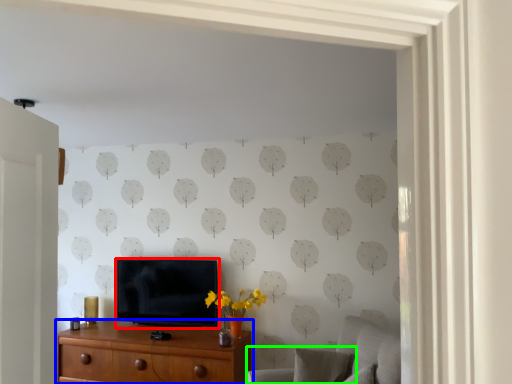
Question: Based on their relative distances, which object is farther from television (highlighted by a red box)? Choose from chest of drawers (highlighted by a blue box) and swivel chair (highlighted by a green box).

Choices:
 (A) chest of drawers
 (B) swivel chair

Answer: (B)